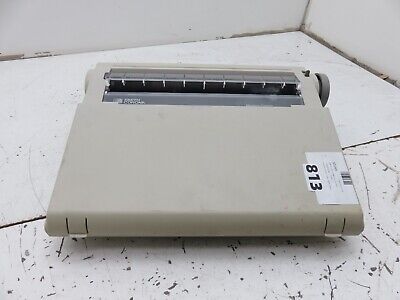
Locate an element on the screen. This screenshot has width=400, height=300. corner is located at coordinates pos(300,26).